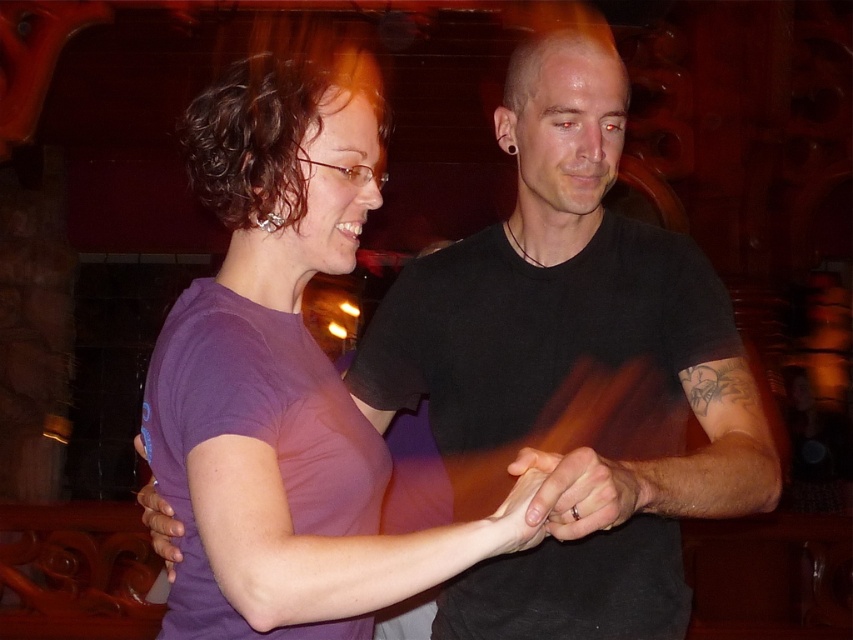
Is point (647, 627) positioned before point (180, 625)?

That is False.

What do you see at coordinates (573, 364) in the screenshot?
I see `black matte t-shirt at center` at bounding box center [573, 364].

Is point (564, 102) behind point (384, 163)?

No, (564, 102) is closer to viewer.

In order to click on black matte t-shirt at center in this screenshot , I will do `click(573, 364)`.

Does black matte t-shirt at center have a larger size compared to matte purple shirt at center?

Indeed, black matte t-shirt at center has a larger size compared to matte purple shirt at center.

Does black matte t-shirt at center appear on the left side of matte purple shirt at center?

Correct, you'll find black matte t-shirt at center to the left of matte purple shirt at center.

In order to click on black matte t-shirt at center in this screenshot , I will do `click(573, 364)`.

Which is below, matte gold ring at center or matte purple shirt at center?

Positioned lower is matte purple shirt at center.

Can you confirm if matte gold ring at center is bigger than matte purple shirt at center?

Correct, matte gold ring at center is larger in size than matte purple shirt at center.

What do you see at coordinates (585, 490) in the screenshot?
I see `matte gold ring at center` at bounding box center [585, 490].

In order to click on matte gold ring at center in this screenshot , I will do `click(585, 490)`.